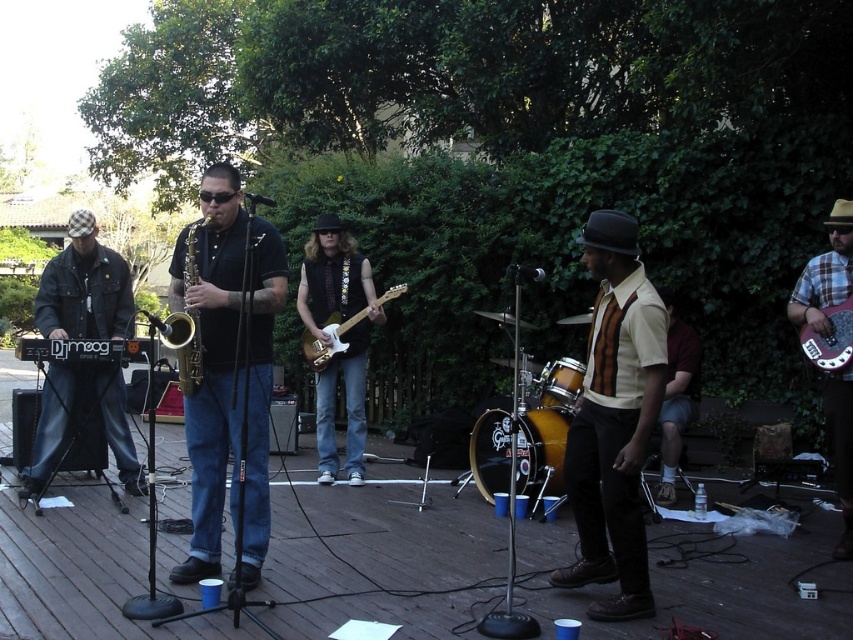
Question: Does shiny gold saxophone at center have a larger size compared to plaid fabric guitar at right?

Choices:
 (A) yes
 (B) no

Answer: (A)

Question: Can you confirm if brown plaid shirt at center is smaller than matte electric guitar at center?

Choices:
 (A) no
 (B) yes

Answer: (A)

Question: Which is nearer to the brown plaid shirt at center?

Choices:
 (A) plaid fabric guitar at right
 (B) matte electric guitar at center
 (C) denim jacket at left
 (D) yellow drum at center

Answer: (D)

Question: Which of the following is the farthest from the observer?

Choices:
 (A) yellow drum at center
 (B) shiny gold saxophone at center
 (C) plaid fabric guitar at right

Answer: (A)

Question: Is gold brass saxophone at center above matte electric guitar at center?

Choices:
 (A) no
 (B) yes

Answer: (B)

Question: Among these objects, which one is nearest to the camera?

Choices:
 (A) plaid fabric guitar at right
 (B) gold saxophone at center

Answer: (B)